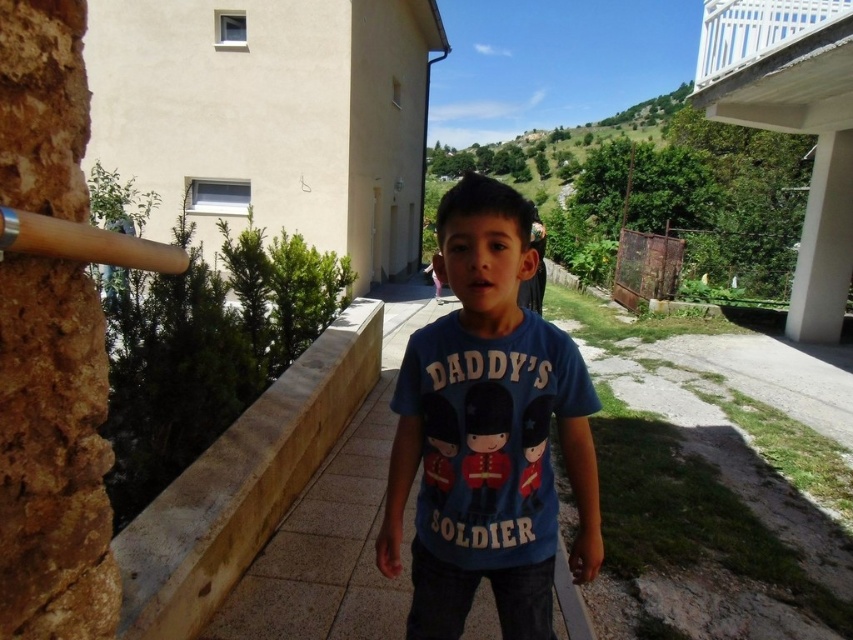
Consider the image. You are a drone operator trying to locate a specific point in the image. The point is marked at coordinates point (242,483). According to the scene description, what object is located at this coordinate?

The point (242,483) indicates a brown concrete ledge at left.

You are a painter who wants to place a small statue on the brown concrete ledge at left so that it can be seen from above the wooden bat at left. Is the ledge tall enough to do this?

The brown concrete ledge at left is taller than the wooden bat at left, so placing the statue on the ledge would allow it to be seen above the bat.

You are a photographer trying to capture the boy in the blue cotton shirt at center and the wooden bat at left. If you want to ensure both are in focus, which object should you focus on first?

The blue cotton shirt at center is much taller than the wooden bat at left, so you should focus on the blue cotton shirt at center first to ensure both are in focus.